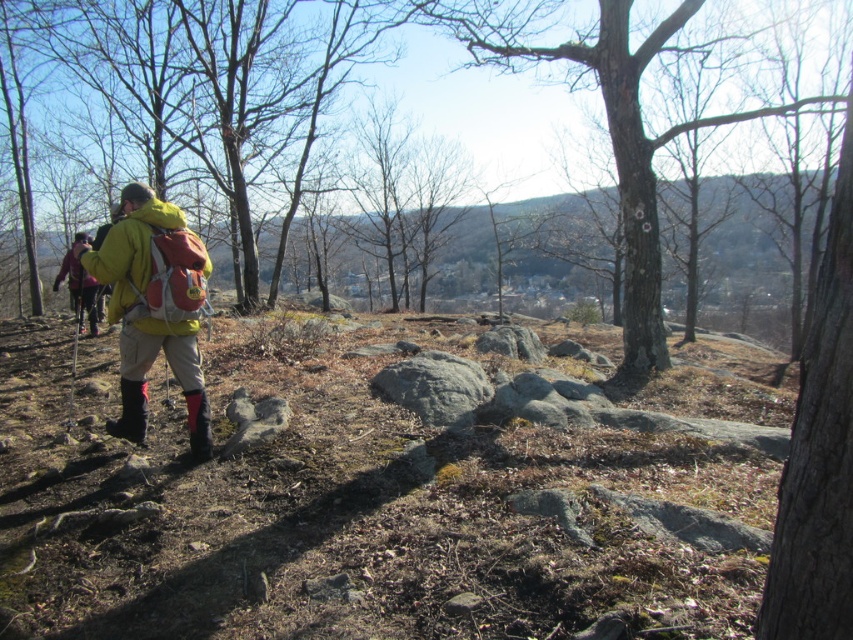
Between matte yellow jacket at center and yellow fleece jacket at center, which one is positioned higher?

Positioned higher is yellow fleece jacket at center.

Can you confirm if matte yellow jacket at center is positioned below yellow fleece jacket at center?

Yes, matte yellow jacket at center is below yellow fleece jacket at center.

The image size is (853, 640). In order to click on matte yellow jacket at center in this screenshot , I will do tap(154, 307).

In order to click on matte yellow jacket at center in this screenshot , I will do [154, 307].

Who is shorter, rubber/matte boot at lower left or rubber/matte boot at lower center?

With less height is rubber/matte boot at lower center.

Which is more to the right, rubber/matte boot at lower left or rubber/matte boot at lower center?

Positioned to the right is rubber/matte boot at lower center.

Is point (134, 420) positioned in front of point (202, 436)?

No.

The width and height of the screenshot is (853, 640). In order to click on rubber/matte boot at lower left in this screenshot , I will do `click(131, 412)`.

Which is more to the right, matte pink jacket at left or rubber/matte boot at lower left?

Positioned to the right is rubber/matte boot at lower left.

Between matte pink jacket at left and rubber/matte boot at lower left, which one has more height?

matte pink jacket at left

Image resolution: width=853 pixels, height=640 pixels. What are the coordinates of `matte pink jacket at left` in the screenshot? It's located at (79, 282).